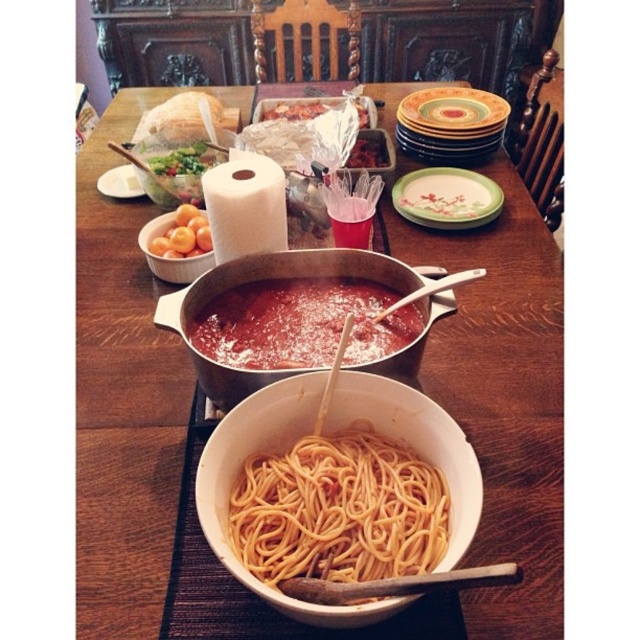
You are a guest sitting at the dining table and want to reach the matte ceramic pot at center to serve yourself some sauce. If your hand can extend 22 inches, will you be able to comfortably reach the pot?

The matte ceramic pot at center is 21.96 inches away from the viewer. Since your hand can extend 22 inches, you can comfortably reach the pot.